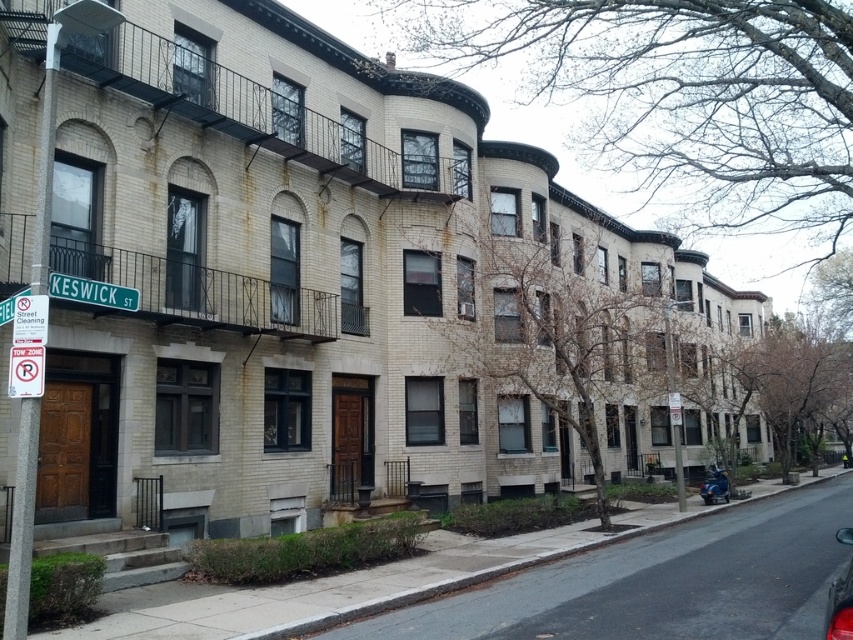
Question: Which of the following is the closest to the observer?

Choices:
 (A) (807, 502)
 (B) (15, 394)

Answer: (B)

Question: Does gray concrete curb at lower center have a smaller size compared to white paper sign at upper left?

Choices:
 (A) yes
 (B) no

Answer: (B)

Question: Is gray concrete curb at lower center bigger than metallic blue scooter at lower right?

Choices:
 (A) no
 (B) yes

Answer: (B)

Question: Does white paper sign at upper left appear on the right side of metallic blue scooter at lower right?

Choices:
 (A) no
 (B) yes

Answer: (A)

Question: Which point is closer to the camera?

Choices:
 (A) red plastic sign at lower left
 (B) shiny red car at lower right

Answer: (B)

Question: Which object appears farthest from the camera in this image?

Choices:
 (A) green metal street sign at upper left
 (B) gray concrete curb at lower center
 (C) white paper sign at upper left

Answer: (A)